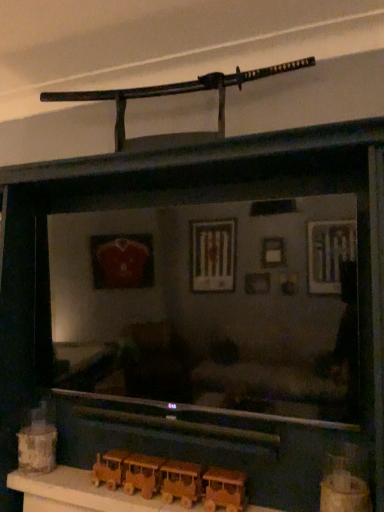
You are a GUI agent. You are given a task and a screenshot of the screen. Output one action in this format:
    pyautogui.click(x=<x>, y=<y>)
    Task: Click on the vacant point above wooden train set at lower center (from a real-world perspective)
    This screenshot has height=512, width=384.
    Given the screenshot: What is the action you would take?
    pyautogui.click(x=112, y=488)